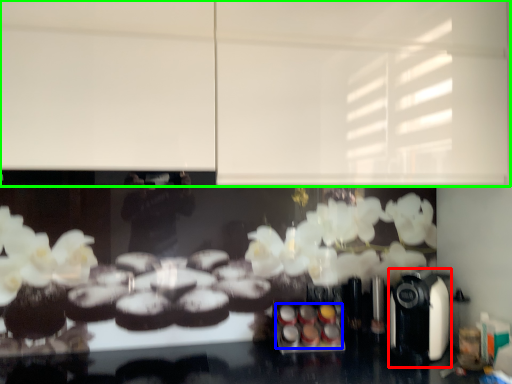
Question: Considering the real-world distances, which object is closest to coffee machine (highlighted by a red box)? food (highlighted by a blue box) or backdrop (highlighted by a green box).

Choices:
 (A) food
 (B) backdrop

Answer: (A)